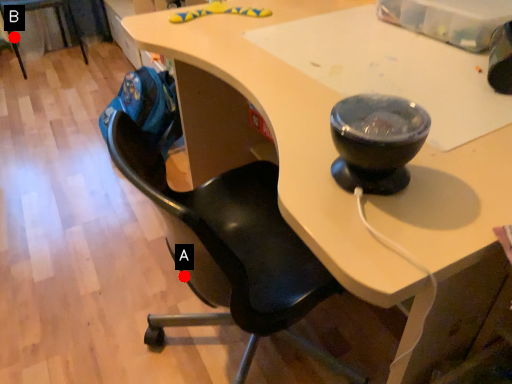
Question: Two points are circled on the image, labeled by A and B beside each circle. Among these points, which one is farthest from the camera?

Choices:
 (A) A is further
 (B) B is further

Answer: (B)